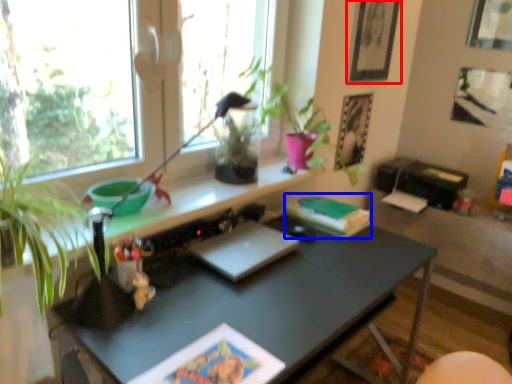
Question: Which object is closer to the camera taking this photo, picture frame (highlighted by a red box) or paperback book (highlighted by a blue box)?

Choices:
 (A) picture frame
 (B) paperback book

Answer: (B)